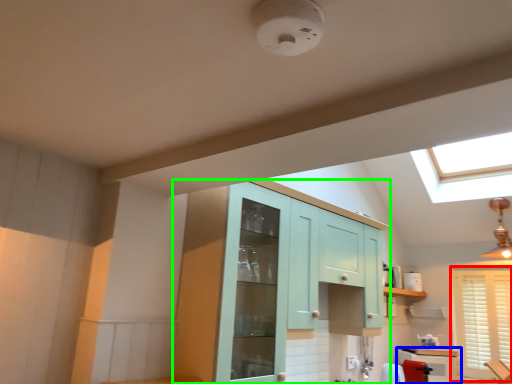
Question: Based on their relative distances, which object is farther from window (highlighted by a red box)? Choose from cabinetry (highlighted by a blue box) and cabinetry (highlighted by a green box).

Choices:
 (A) cabinetry
 (B) cabinetry

Answer: (B)